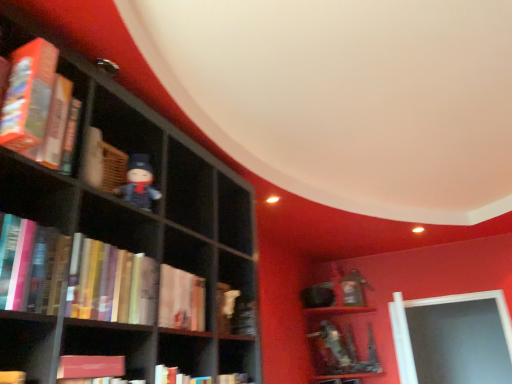
Question: Considering the relative positions of hardcover book at center, which is the first book from bottom to top, and hardcover book at left, marked as the first book in a top-to-bottom arrangement, in the image provided, is hardcover book at center, which is the first book from bottom to top, to the left or to the right of hardcover book at left, marked as the first book in a top-to-bottom arrangement,?

Choices:
 (A) left
 (B) right

Answer: (B)

Question: From their relative heights in the image, would you say hardcover book at center, which is the first book from bottom to top, is taller or shorter than hardcover book at left, marked as the first book in a top-to-bottom arrangement?

Choices:
 (A) short
 (B) tall

Answer: (A)

Question: Which is nearer to the hardcover book at center, which is the first book from bottom to top?

Choices:
 (A) hardcover book at left, which ranks as the 2th book in top-to-bottom order
 (B) hardcover book at left, which is the fourth book in bottom-to-top order
 (C) matte black figurine at center-left
 (D) hardcover books at left, the second book ordered from the bottom

Answer: (D)

Question: Estimate the real-world distances between objects in this image. Which object is farther from the hardcover books at left, the second book ordered from the bottom?

Choices:
 (A) matte black figurine at center-left
 (B) hardcover book at left, which ranks as the 2th book in top-to-bottom order
 (C) hardcover book at center, the fourth book when ordered from top to bottom
 (D) hardcover book at left, which is the fourth book in bottom-to-top order

Answer: (D)